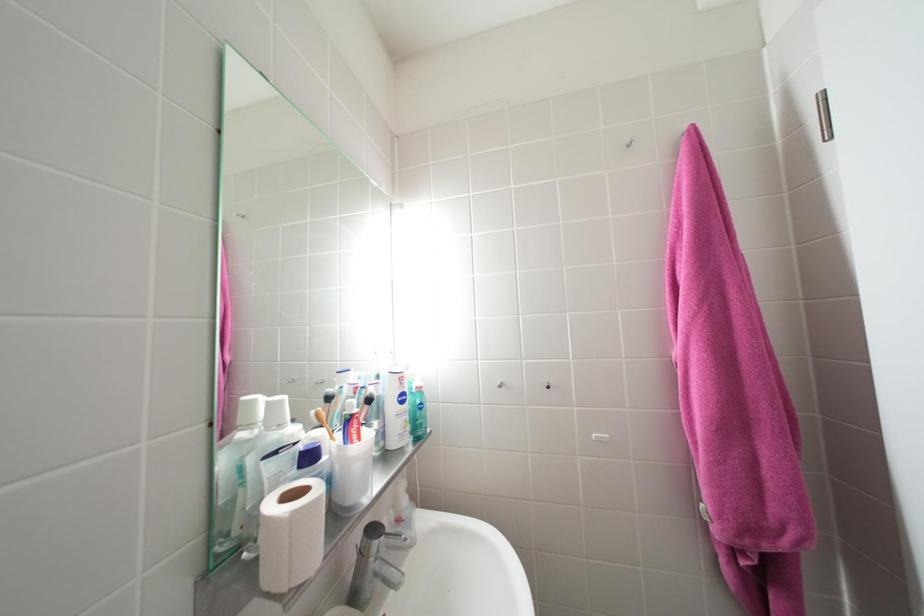
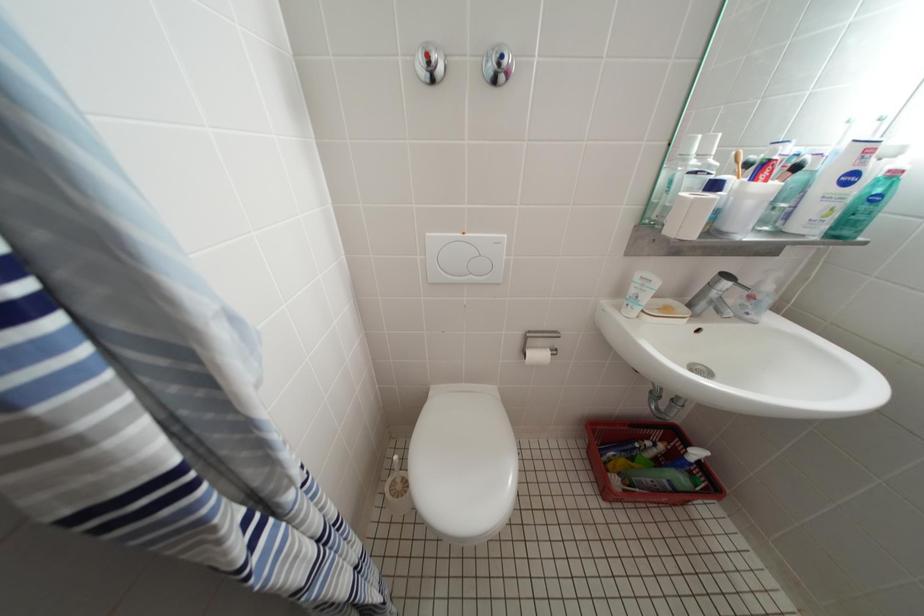
First-person continuous shooting, in which direction is the camera rotating?

The rotation direction of the camera is left-down.